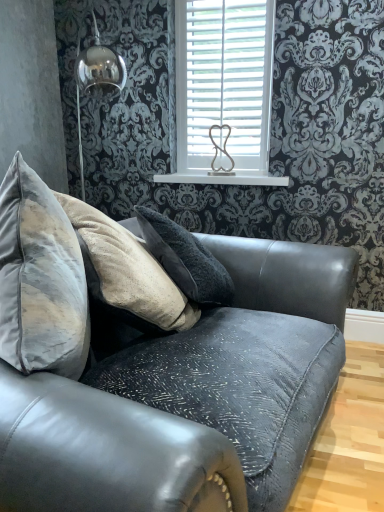
Question: Is white glossy shelf at upper center not near white wooden blinds at upper center?

Choices:
 (A) no
 (B) yes

Answer: (A)

Question: Is white glossy shelf at upper center not inside white wooden blinds at upper center?

Choices:
 (A) no
 (B) yes

Answer: (B)

Question: Is white glossy shelf at upper center positioned with its back to white wooden blinds at upper center?

Choices:
 (A) no
 (B) yes

Answer: (A)

Question: Considering the relative positions of white glossy shelf at upper center and white wooden blinds at upper center in the image provided, is white glossy shelf at upper center behind white wooden blinds at upper center?

Choices:
 (A) yes
 (B) no

Answer: (A)

Question: Is white glossy shelf at upper center next to white wooden blinds at upper center?

Choices:
 (A) yes
 (B) no

Answer: (B)

Question: From the image's perspective, is white glossy shelf at upper center located above white wooden blinds at upper center?

Choices:
 (A) yes
 (B) no

Answer: (B)

Question: Could you tell me if white wooden blinds at upper center is facing velvet grey couch at center?

Choices:
 (A) no
 (B) yes

Answer: (B)

Question: Is white wooden blinds at upper center smaller than velvet grey couch at center?

Choices:
 (A) no
 (B) yes

Answer: (B)

Question: Is white wooden blinds at upper center positioned with its back to velvet grey couch at center?

Choices:
 (A) no
 (B) yes

Answer: (A)

Question: Is white wooden blinds at upper center further to camera compared to velvet grey couch at center?

Choices:
 (A) yes
 (B) no

Answer: (A)

Question: Can you confirm if white wooden blinds at upper center is bigger than velvet grey couch at center?

Choices:
 (A) yes
 (B) no

Answer: (B)

Question: Is white wooden blinds at upper center far from velvet grey couch at center?

Choices:
 (A) no
 (B) yes

Answer: (B)

Question: Does white wooden blinds at upper center come behind white glossy shelf at upper center?

Choices:
 (A) no
 (B) yes

Answer: (A)